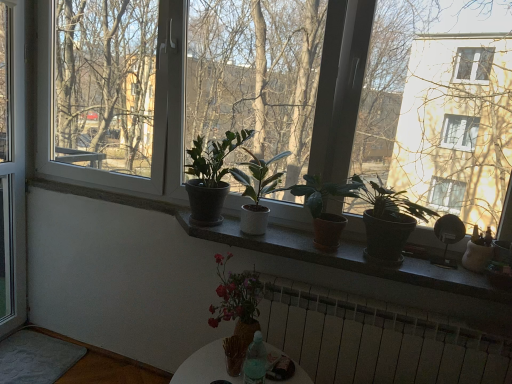
At what (x,y) coordinates should I click in order to perform the action: click on free space above soft gray carpet at lower left (from a real-world perspective). Please return your answer as a coordinate pair (x, y). The image size is (512, 384). Looking at the image, I should click on (19, 358).